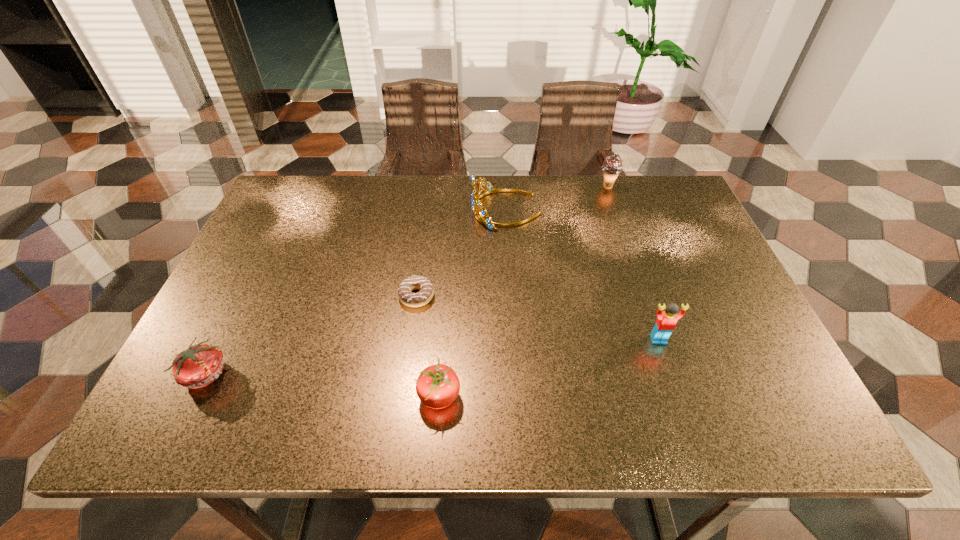
Find the location of a particular element. This screenshot has width=960, height=540. free space between the icecream and the third object from right to left is located at coordinates (557, 198).

Identify the location of vacant space that is in between the fourth farthest object and the leftmost object. The height and width of the screenshot is (540, 960). (432, 356).

Where is `free area in between the icecream and the doughnut`? free area in between the icecream and the doughnut is located at coordinates (512, 241).

Where is `empty space that is in between the third farthest object and the fourth farthest object`? The image size is (960, 540). empty space that is in between the third farthest object and the fourth farthest object is located at coordinates (538, 318).

Locate an element on the screen. This screenshot has height=540, width=960. object identified as the closest to the doughnut is located at coordinates (438, 386).

Identify which object is the closest to the third object from right to left. Please provide its 2D coordinates. Your answer should be formatted as a tuple, i.e. [(x, y)], where the tuple contains the x and y coordinates of a point satisfying the conditions above.

[(612, 166)]

Find the location of a particular element. vacant space that satisfies the following two spatial constraints: 1. on the back side of the doughnut; 2. on the left side of the left tomato is located at coordinates (245, 296).